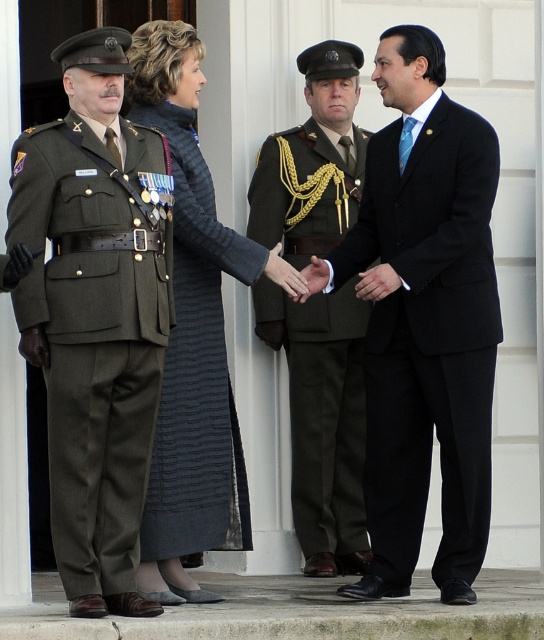
Is green fabric uniform at left to the left of dark gray textured coat at center from the viewer's perspective?

Correct, you'll find green fabric uniform at left to the left of dark gray textured coat at center.

Does green fabric uniform at left have a greater width compared to dark gray textured coat at center?

No, green fabric uniform at left is not wider than dark gray textured coat at center.

Find the location of `green fabric uniform at left`. green fabric uniform at left is located at coordinates point(92,349).

Where is `black satin suit at center`? The height and width of the screenshot is (640, 544). black satin suit at center is located at coordinates (423, 320).

In the scene shown: Who is more distant from viewer, [424,490] or [238,502]?

The point [238,502] is more distant.

Locate an element on the screen. black satin suit at center is located at coordinates (423, 320).

Can you confirm if black satin suit at center is positioned to the right of green fabric uniform at left?

Yes, black satin suit at center is to the right of green fabric uniform at left.

Is black satin suit at center to the left of green fabric uniform at left from the viewer's perspective?

In fact, black satin suit at center is to the right of green fabric uniform at left.

Find the location of a particular element. This screenshot has width=544, height=640. black satin suit at center is located at coordinates (423, 320).

Find the location of a particular element. black satin suit at center is located at coordinates (423, 320).